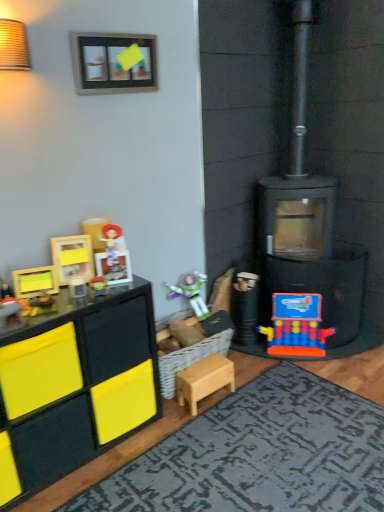
I want to click on blank space above textured gray rug at lower center (from a real-world perspective), so click(267, 450).